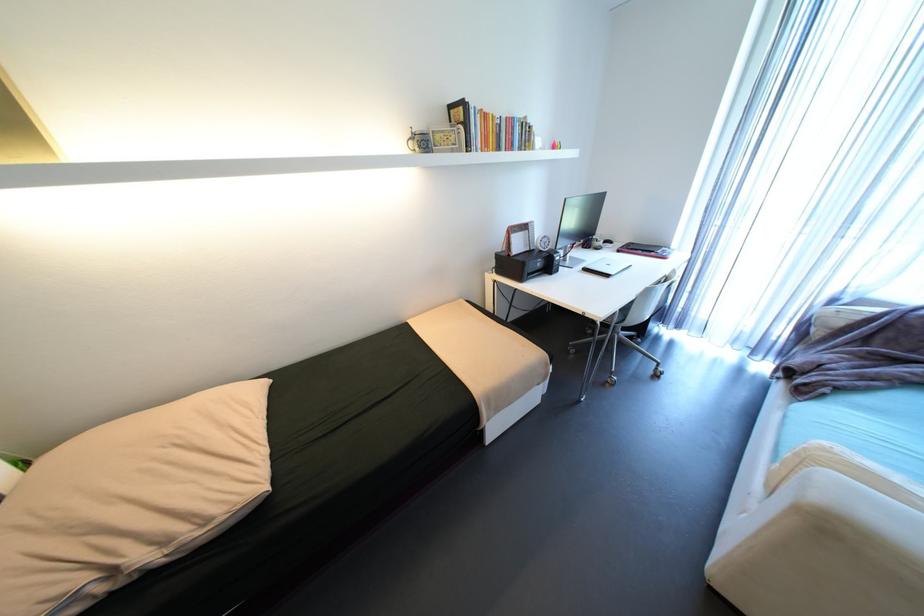
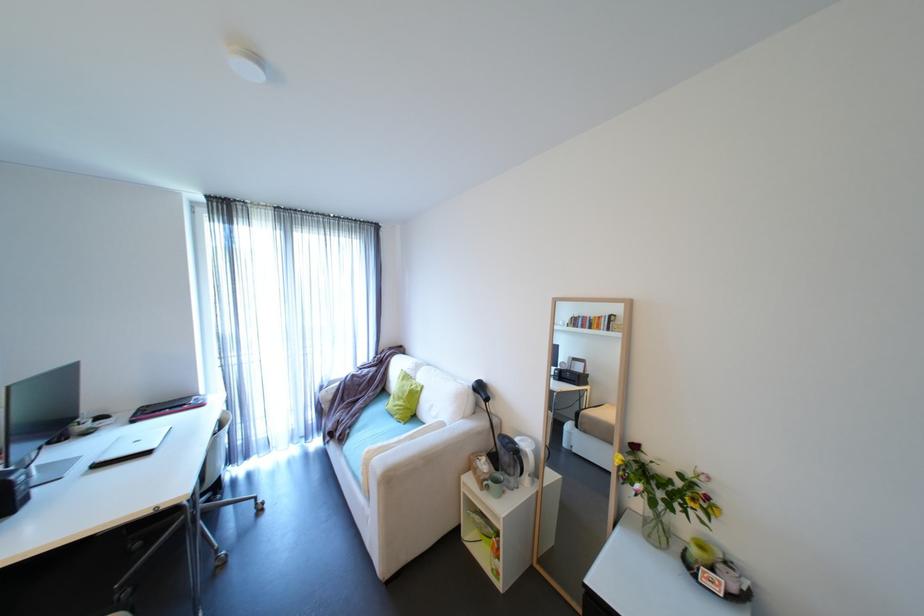
Locate, in the second image, the point that corresponds to the point at 809,389 in the first image.

(347, 438)